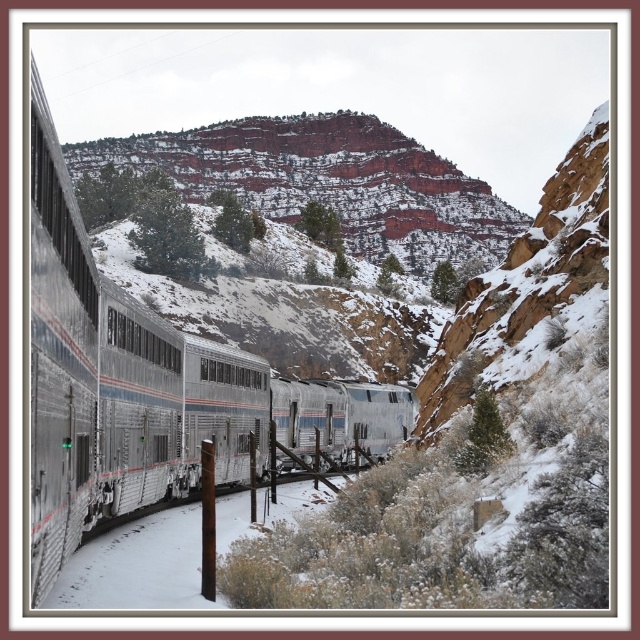
Based on the photo, you are standing at the camera position and want to take a photo of the silver metallic train at left. If your camera has a maximum focus range of 30 meters, will you be able to capture the train clearly?

The silver metallic train at left and camera are 31.86 meters apart, which exceeds the camera maximum focus range of 30 meters. Therefore, the train will not be in focus.